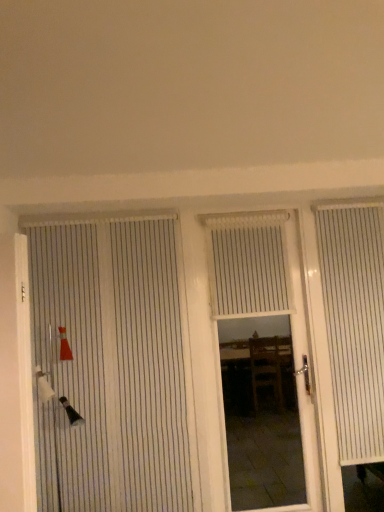
Where is `vacant region above white textured blind at center (from a real-world perspective)`? vacant region above white textured blind at center (from a real-world perspective) is located at coordinates (245, 216).